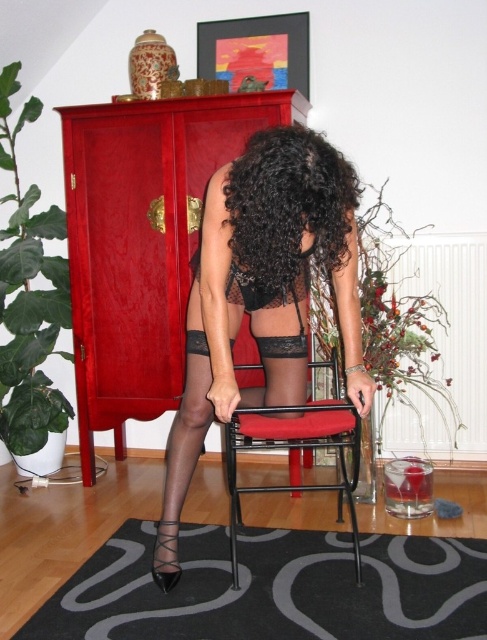
You are a photographer setting up a shoot in this room. You need to position a light source so that it illuminates the black curly hair at center without casting a shadow on the black metal chair at center. Where should you place the light relative to the person?

The black curly hair at center is located above the black metal chair at center, so placing the light source above the person would illuminate the hair while avoiding casting a shadow on the chair below.

You are an interior designer assessing the layout of this room. The shiny lacquered cabinet at center and the black curly hair at center are both in view. Which object is positioned to the left of the other?

The shiny lacquered cabinet at center is to the left of black curly hair at center.